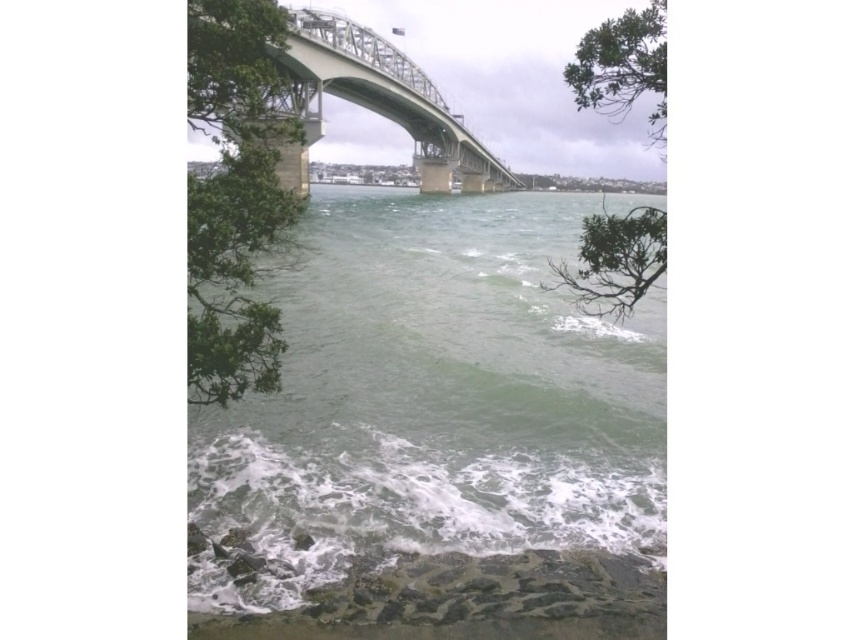
You are an architect evaluating the scene. The green leafy tree at upper left and the steel bridge at center are both visible in the image. Which object occupies more visual space in the scene?

The steel bridge at center occupies more visual space than the green leafy tree at upper left because it is larger in size according to the description.

You are an architect analyzing the spatial relationship between the green leafy tree at upper left and the steel bridge at center in the image. Which object occupies more horizontal space in the scene?

The steel bridge at center occupies more horizontal space than the green leafy tree at upper left because the green leafy tree at upper left has a lesser width compared to steel bridge at center.